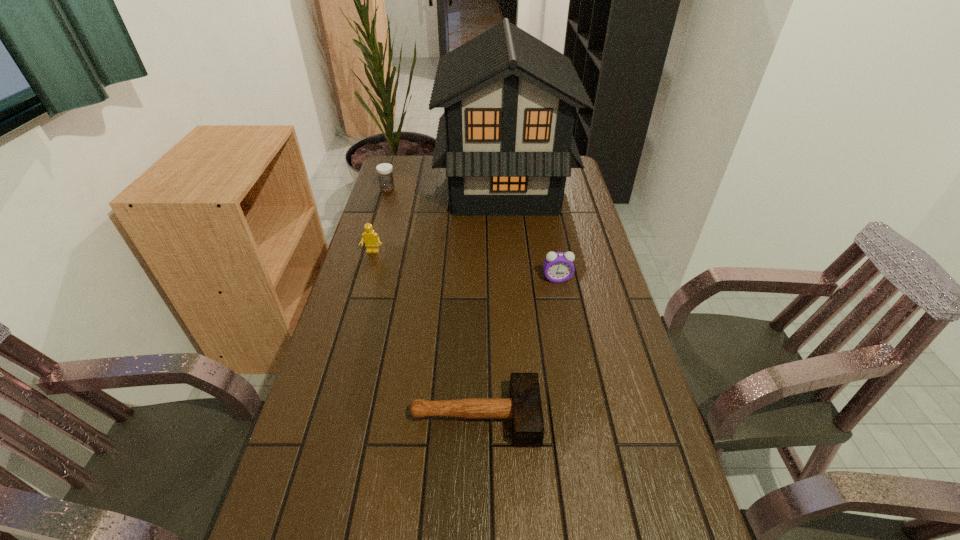
Where is `free point located 0.370m on the face of the second nearest object`? The image size is (960, 540). free point located 0.370m on the face of the second nearest object is located at coordinates (578, 387).

Image resolution: width=960 pixels, height=540 pixels. Find the location of `free space located on the back of the medicine`. free space located on the back of the medicine is located at coordinates (392, 176).

At what (x,y) coordinates should I click in order to perform the action: click on vacant space located on the hammer head face of the mallet. Please return your answer as a coordinate pair (x, y). Looking at the image, I should click on 610,416.

The height and width of the screenshot is (540, 960). In order to click on object that is positioned at the far edge in this screenshot , I will do `click(506, 140)`.

What are the coordinates of `Lego that is at the left edge` in the screenshot? It's located at (370, 238).

At what (x,y) coordinates should I click in order to perform the action: click on medicine located at the left edge. Please return your answer as a coordinate pair (x, y). The width and height of the screenshot is (960, 540). Looking at the image, I should click on (384, 170).

In order to click on dollhouse located in the right edge section of the desktop in this screenshot , I will do `click(506, 140)`.

The image size is (960, 540). I want to click on alarm clock present at the right edge, so click(558, 266).

Find the location of a particular element. object that is at the far right corner is located at coordinates (506, 140).

Find the location of `blank space at the left edge of the desktop`. blank space at the left edge of the desktop is located at coordinates (331, 479).